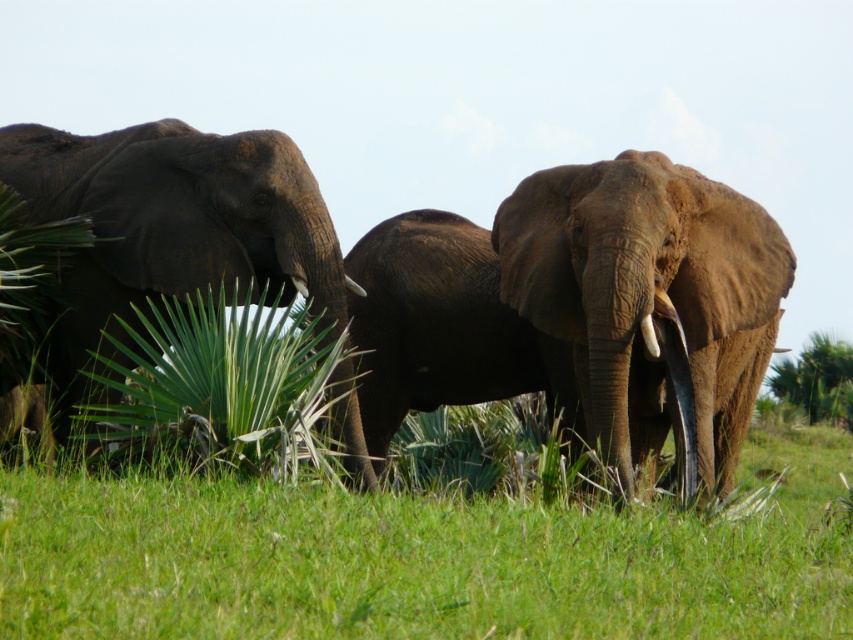
Looking at this image, between dark brown elephant at left and white ivory tusk at center, which one appears on the left side from the viewer's perspective?

dark brown elephant at left

You are a GUI agent. You are given a task and a screenshot of the screen. Output one action in this format:
    pyautogui.click(x=<x>, y=<y>)
    Task: Click on the dark brown elephant at left
    
    Given the screenshot: What is the action you would take?
    pyautogui.click(x=173, y=225)

Who is positioned more to the right, green leafy tree at center or white glossy tusk at center?

green leafy tree at center is more to the right.

Between green leafy tree at center and white glossy tusk at center, which one is positioned higher?

white glossy tusk at center

The height and width of the screenshot is (640, 853). I want to click on green leafy tree at center, so click(817, 380).

I want to click on green leafy tree at center, so click(x=817, y=380).

Who is positioned more to the right, brown rough elephant at center or white glossy tusk at center?

brown rough elephant at center is more to the right.

Image resolution: width=853 pixels, height=640 pixels. Identify the location of brown rough elephant at center. (650, 301).

Describe the element at coordinates (650, 301) in the screenshot. I see `brown rough elephant at center` at that location.

Find the location of a particular element. brown rough elephant at center is located at coordinates (650, 301).